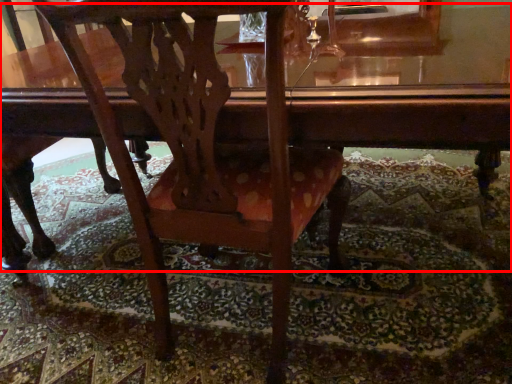
Question: From the image's perspective, what is the correct spatial relationship of table (annotated by the red box) in relation to chair?

Choices:
 (A) above
 (B) below

Answer: (A)